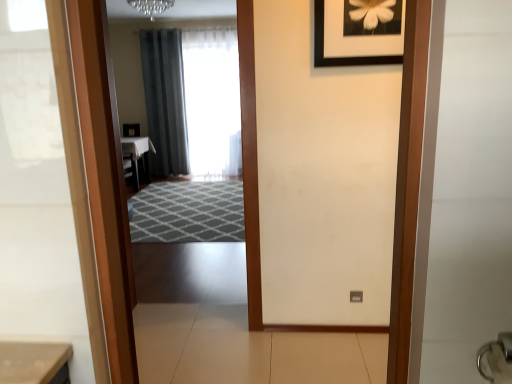
Describe the element at coordinates (497, 358) in the screenshot. The width and height of the screenshot is (512, 384). I see `silver metallic door handle at lower right` at that location.

The image size is (512, 384). What are the coordinates of `white glossy table at center` in the screenshot? It's located at (137, 155).

Where is `dark gray fabric curtain at center, acting as the first curtain starting from the left`? Image resolution: width=512 pixels, height=384 pixels. dark gray fabric curtain at center, acting as the first curtain starting from the left is located at coordinates (165, 100).

Is dark gray fabric curtain at center, which appears as the 2th curtain when viewed from the right, completely or partially outside of transparent glass mirror at center?

Yes.

Based on the photo, is dark gray fabric curtain at center, which appears as the 2th curtain when viewed from the right, turned away from transparent glass mirror at center?

No, dark gray fabric curtain at center, which appears as the 2th curtain when viewed from the right,'s orientation is not away from transparent glass mirror at center.

From the image's perspective, which object appears higher, dark gray fabric curtain at center, which appears as the 2th curtain when viewed from the right, or transparent glass mirror at center?

From the image's view, dark gray fabric curtain at center, which appears as the 2th curtain when viewed from the right, is above.

Is dark gray fabric curtain at center, acting as the first curtain starting from the left, taller than white glossy table at center?

Indeed, dark gray fabric curtain at center, acting as the first curtain starting from the left, has a greater height compared to white glossy table at center.

Is dark gray fabric curtain at center, acting as the first curtain starting from the left, wider than white glossy table at center?

No.

In the scene shown: Could you tell me if dark gray fabric curtain at center, which appears as the 2th curtain when viewed from the right, is turned towards white glossy table at center?

Yes, dark gray fabric curtain at center, which appears as the 2th curtain when viewed from the right, faces towards white glossy table at center.

Is point (216, 43) positioned in front of point (167, 141)?

Yes, point (216, 43) is closer to viewer.

At what (x,y) coordinates should I click in order to perform the action: click on curtain in front of the dark gray fabric curtain at center, which appears as the 2th curtain when viewed from the right. Please return your answer as a coordinate pair (x, y). This screenshot has width=512, height=384. Looking at the image, I should click on (212, 101).

Is white sheer curtain at center, the first curtain from the right, next to dark gray fabric curtain at center, which appears as the 2th curtain when viewed from the right?

No, white sheer curtain at center, the first curtain from the right, is not touching dark gray fabric curtain at center, which appears as the 2th curtain when viewed from the right.

You are a GUI agent. You are given a task and a screenshot of the screen. Output one action in this format:
    pyautogui.click(x=<x>, y=<y>)
    Task: Click on the light fixture above the silver metallic door handle at lower right (from a real-world perspective)
    Image resolution: width=512 pixels, height=384 pixels.
    Given the screenshot: What is the action you would take?
    pyautogui.click(x=151, y=6)

In the scene shown: Which point is more forward, (482, 375) or (152, 6)?

The point (482, 375) is in front.

Is silver metallic door handle at lower right turned away from crystal glass chandelier at upper center?

No, silver metallic door handle at lower right is not facing the opposite direction of crystal glass chandelier at upper center.

Is white glossy table at center not inside crystal glass chandelier at upper center?

Indeed, white glossy table at center is completely outside crystal glass chandelier at upper center.

Is white glossy table at center next to crystal glass chandelier at upper center?

No, white glossy table at center is not making contact with crystal glass chandelier at upper center.

Considering the relative sizes of white glossy table at center and crystal glass chandelier at upper center in the image provided, is white glossy table at center wider than crystal glass chandelier at upper center?

Yes.

Which of these two, white glossy table at center or crystal glass chandelier at upper center, stands shorter?

With less height is crystal glass chandelier at upper center.

Consider the image. Is black matte picture frame at upper center shorter than transparent glass mirror at center?

Indeed, black matte picture frame at upper center has a lesser height compared to transparent glass mirror at center.

Is black matte picture frame at upper center positioned with its back to transparent glass mirror at center?

No.

Which is nearer, (338, 55) or (187, 234)?

Positioned in front is point (338, 55).

From the image's perspective, does black matte picture frame at upper center appear lower than transparent glass mirror at center?

No.

Considering the relative positions of crystal glass chandelier at upper center and white glossy table at center in the image provided, is crystal glass chandelier at upper center behind white glossy table at center?

No, it is not.

Consider the image. Does crystal glass chandelier at upper center have a lesser width compared to white glossy table at center?

Indeed, crystal glass chandelier at upper center has a lesser width compared to white glossy table at center.

In the image, there is a crystal glass chandelier at upper center. Identify the location of table below it (from the image's perspective). (137, 155).

Is crystal glass chandelier at upper center at the left side of white glossy table at center?

No, crystal glass chandelier at upper center is not to the left of white glossy table at center.

Find the location of a particular element. mirror on the right of dark gray fabric curtain at center, acting as the first curtain starting from the left is located at coordinates [188, 129].

Image resolution: width=512 pixels, height=384 pixels. I want to click on table that appears below the dark gray fabric curtain at center, which appears as the 2th curtain when viewed from the right (from a real-world perspective), so [x=137, y=155].

Looking at the image, which one is located closer to transparent glass mirror at center, white sheer curtain at center, the first curtain from the right, or black matte picture frame at upper center?

Among the two, white sheer curtain at center, the first curtain from the right, is located nearer to transparent glass mirror at center.

When comparing their distances from silver metallic door handle at lower right, does transparent glass mirror at center or black matte picture frame at upper center seem further?

transparent glass mirror at center.

Looking at the image, which one is located closer to transparent glass mirror at center, white glossy table at center or crystal glass chandelier at upper center?

white glossy table at center is positioned closer to the anchor transparent glass mirror at center.

Based on their spatial positions, is dark gray fabric curtain at center, acting as the first curtain starting from the left, or white glossy table at center further from white sheer curtain at center, the second curtain when ordered from left to right?

Among the two, white glossy table at center is located further to white sheer curtain at center, the second curtain when ordered from left to right.

Estimate the real-world distances between objects in this image. Which object is further from white glossy table at center, crystal glass chandelier at upper center or transparent glass mirror at center?

crystal glass chandelier at upper center is positioned further to the anchor white glossy table at center.

Which object lies nearer to the anchor point transparent glass mirror at center, white glossy table at center or dark gray fabric curtain at center, acting as the first curtain starting from the left?

dark gray fabric curtain at center, acting as the first curtain starting from the left, is positioned closer to the anchor transparent glass mirror at center.

Estimate the real-world distances between objects in this image. Which object is closer to crystal glass chandelier at upper center, dark gray fabric curtain at center, acting as the first curtain starting from the left, or white sheer curtain at center, the first curtain from the right?

dark gray fabric curtain at center, acting as the first curtain starting from the left, is positioned closer to the anchor crystal glass chandelier at upper center.

Which object lies nearer to the anchor point white glossy table at center, white sheer curtain at center, the second curtain when ordered from left to right, or dark gray fabric curtain at center, acting as the first curtain starting from the left?

dark gray fabric curtain at center, acting as the first curtain starting from the left, is positioned closer to the anchor white glossy table at center.

At what (x,y) coordinates should I click in order to perform the action: click on table located between black matte picture frame at upper center and white sheer curtain at center, the second curtain when ordered from left to right, in the depth direction. Please return your answer as a coordinate pair (x, y). The width and height of the screenshot is (512, 384). Looking at the image, I should click on (137, 155).

At what (x,y) coordinates should I click in order to perform the action: click on picture frame between silver metallic door handle at lower right and dark gray fabric curtain at center, which appears as the 2th curtain when viewed from the right, along the z-axis. Please return your answer as a coordinate pair (x, y). Looking at the image, I should click on (359, 32).

Locate an element on the screen. The height and width of the screenshot is (384, 512). table between silver metallic door handle at lower right and dark gray fabric curtain at center, acting as the first curtain starting from the left, in the front-back direction is located at coordinates click(137, 155).

Where is `light fixture located between silver metallic door handle at lower right and dark gray fabric curtain at center, acting as the first curtain starting from the left, in the depth direction`? Image resolution: width=512 pixels, height=384 pixels. light fixture located between silver metallic door handle at lower right and dark gray fabric curtain at center, acting as the first curtain starting from the left, in the depth direction is located at coordinates (151, 6).